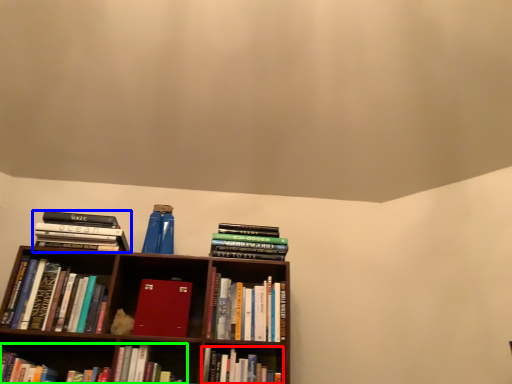
Question: Which is farther away from book (highlighted by a red box)? book (highlighted by a blue box) or book (highlighted by a green box)?

Choices:
 (A) book
 (B) book

Answer: (A)